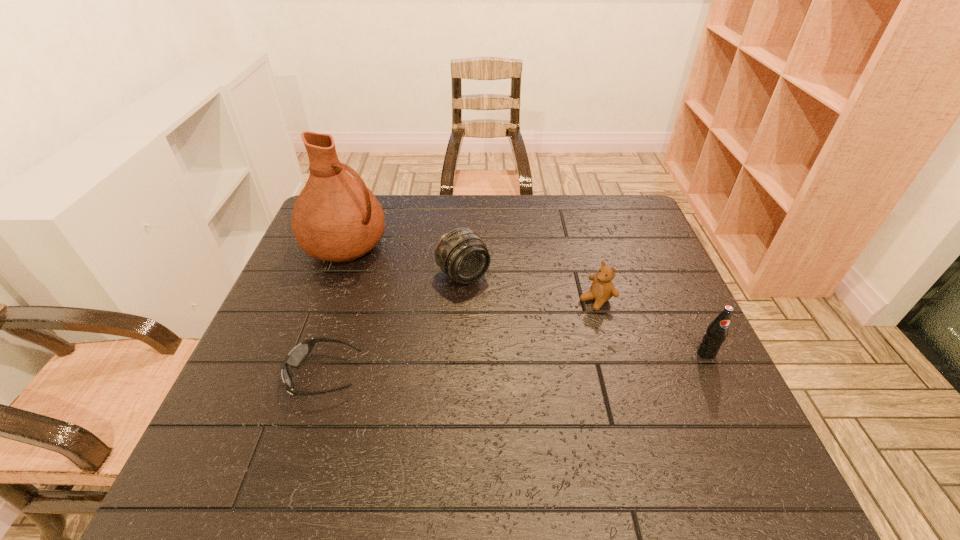
What are the coordinates of `free space on the desktop that is between the shortest object and the rightmost object and is positioned at the front element of the telephoto lens` in the screenshot? It's located at (541, 362).

Identify the location of free space on the desktop that is between the shortest object and the rightmost object and is positioned on the side of the tallest object with the handle. coord(576,360).

Locate an element on the screen. free space on the desktop that is between the sunglasses and the rightmost object and is positioned on the front-facing side of the fourth tallest object is located at coordinates pyautogui.click(x=501, y=364).